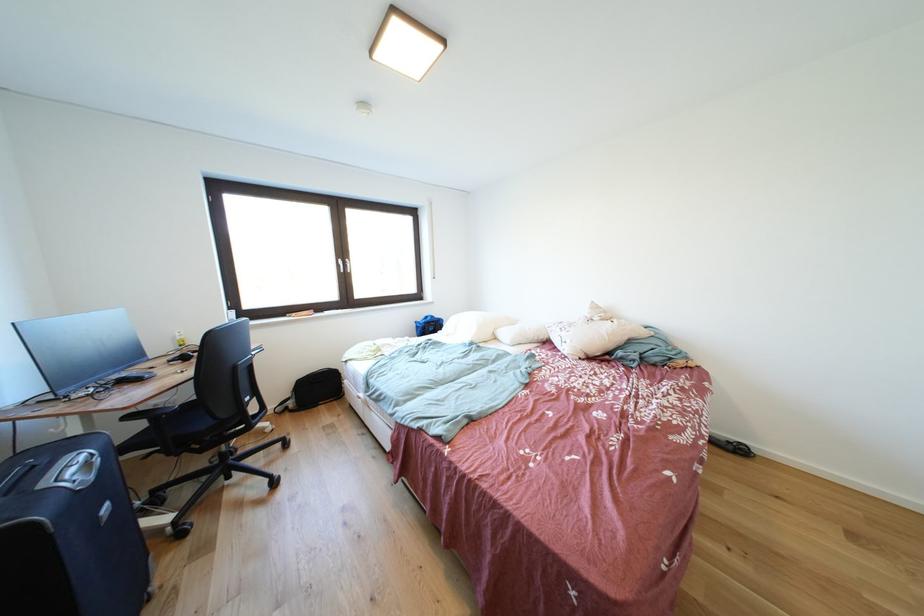
Find the location of a particular element. black chair armrest is located at coordinates (149, 411).